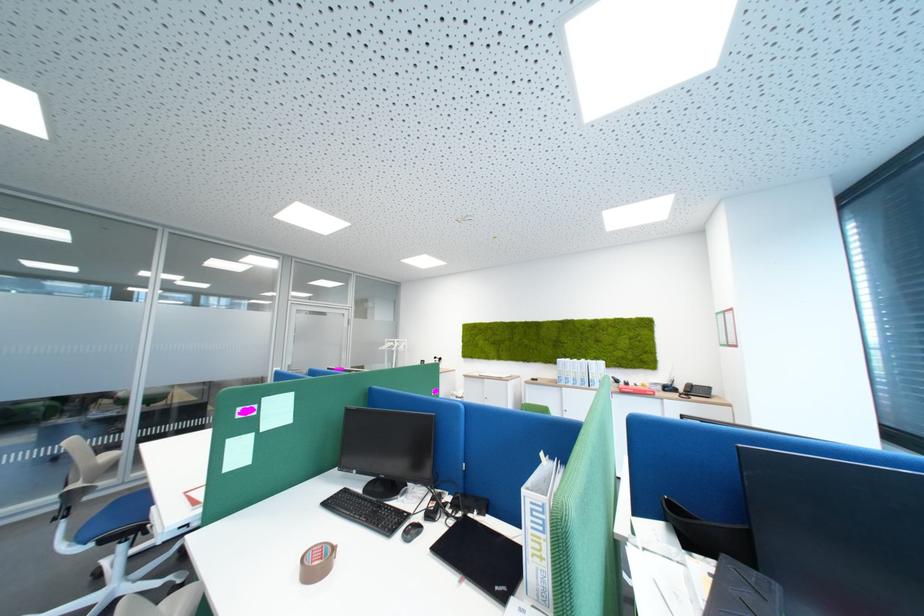
Where would you pull the door handle? Please return your answer as a coordinate pair (x, y).

(727, 397)